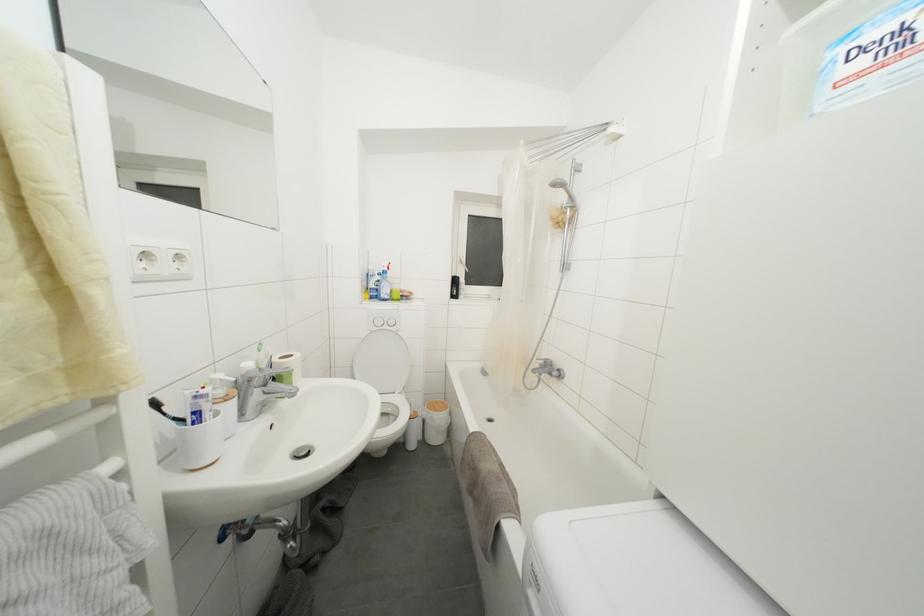
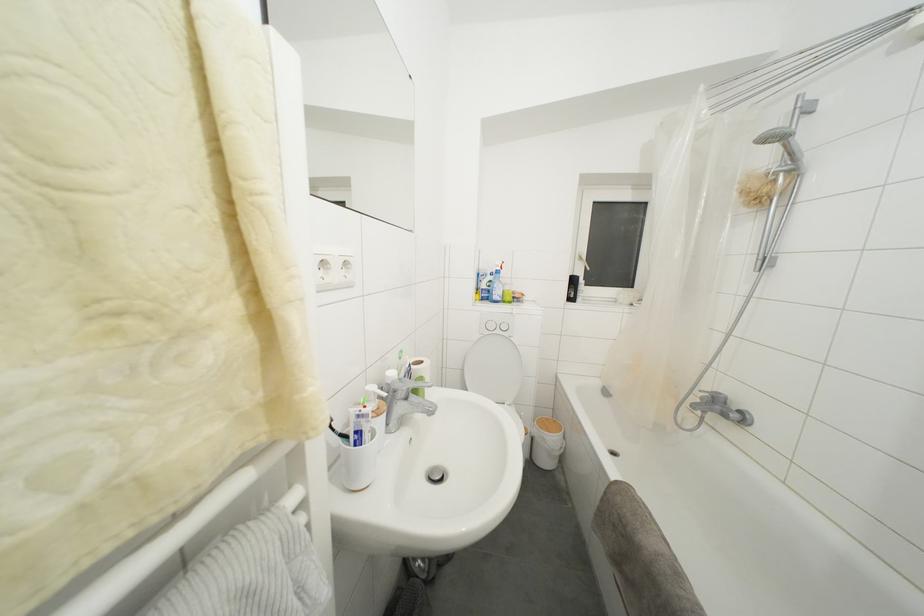
In the second image, find the point that corresponds to pixel 458 286 in the first image.

(578, 286)